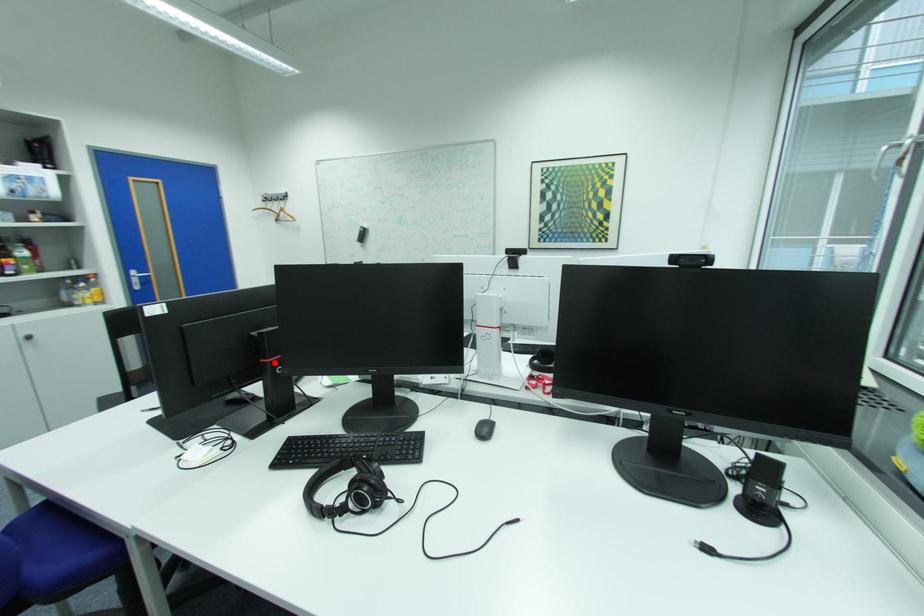
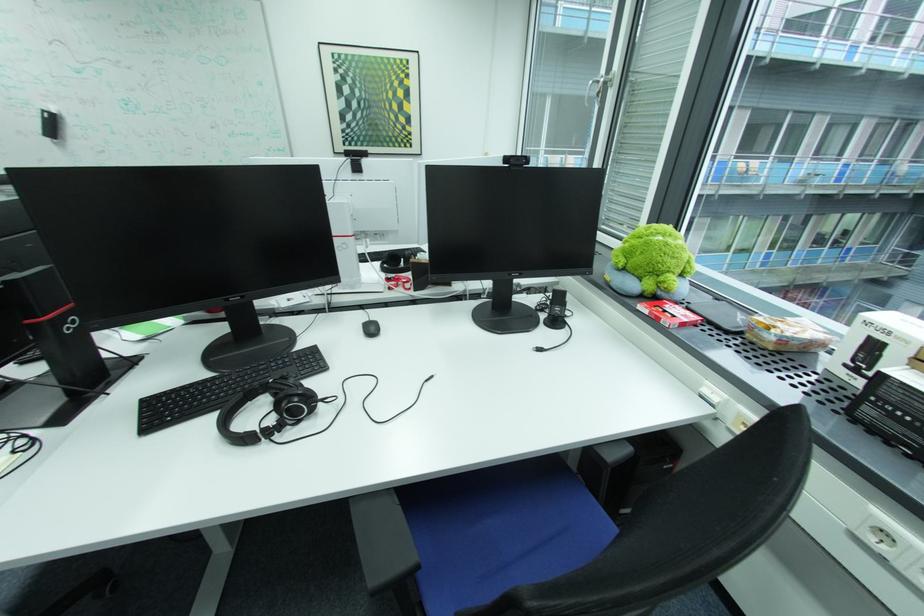
The point at the highlighted location is marked in the first image. Where is the corresponding point in the second image?

(47, 323)